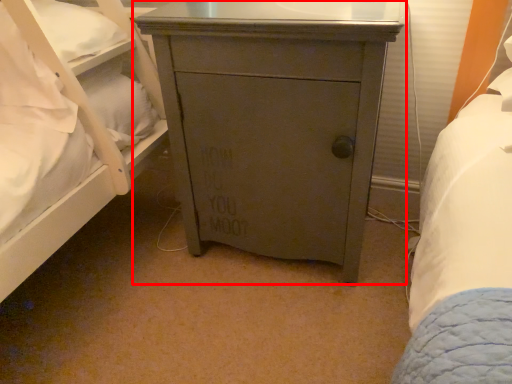
Question: In this image, where is chest of drawers (annotated by the red box) located relative to pillow?

Choices:
 (A) left
 (B) right

Answer: (B)